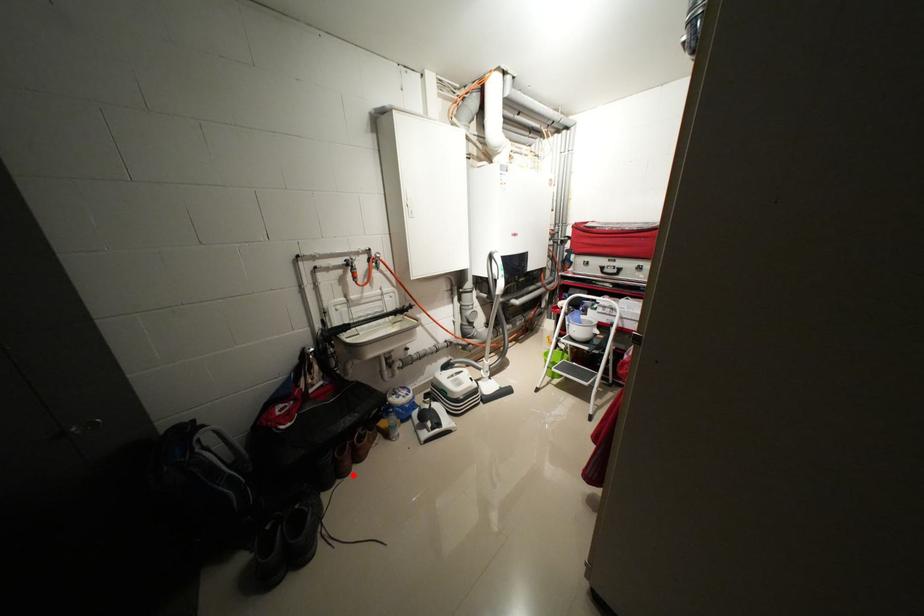
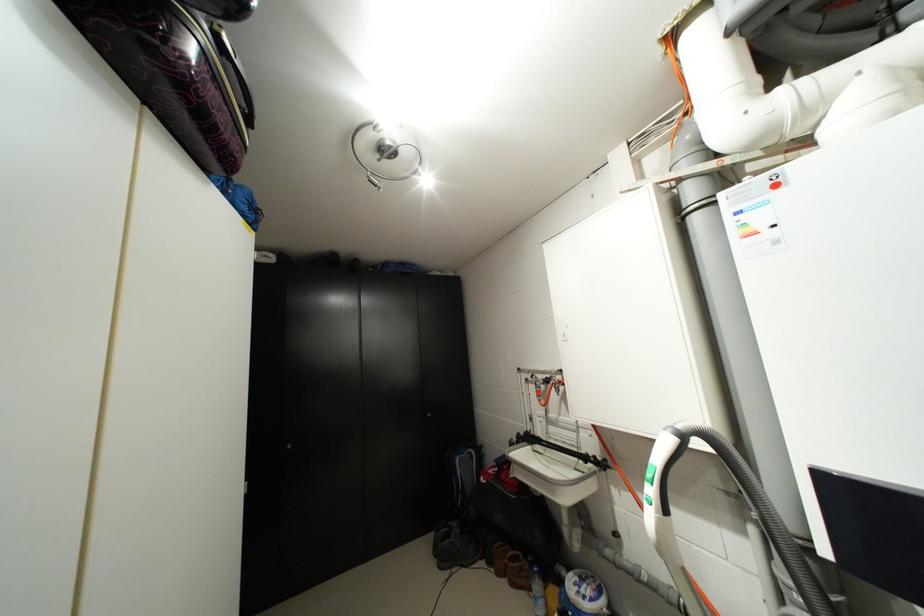
Question: I am providing you with two images of the same scene from different viewpoints. Given a red point in image1, look at the same physical point in image2. Is it:

Choices:
 (A) Closer to the viewpoint
 (B) Farther from the viewpoint

Answer: (B)